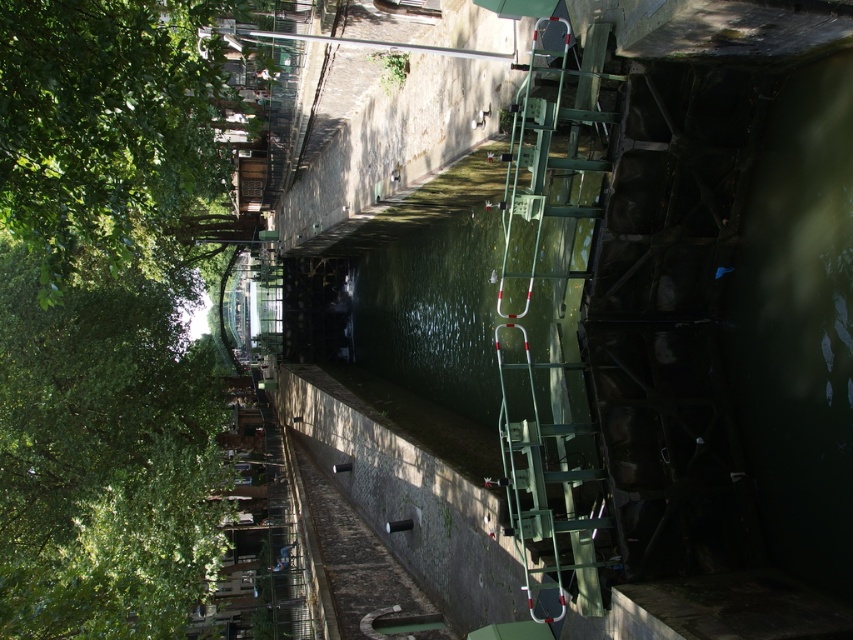
Question: Is green leafy tree at left wider than green metallic ladder at right?

Choices:
 (A) no
 (B) yes

Answer: (B)

Question: Is green leafy tree at left below green metallic ladder at right?

Choices:
 (A) no
 (B) yes

Answer: (B)

Question: Does green leafy tree at upper left appear over green metallic ladder at right?

Choices:
 (A) yes
 (B) no

Answer: (A)

Question: Estimate the real-world distances between objects in this image. Which object is farther from the green leafy tree at upper left?

Choices:
 (A) green metallic ladder at right
 (B) green leafy tree at left

Answer: (A)

Question: Which is farther from the green leafy tree at upper left?

Choices:
 (A) green metallic ladder at right
 (B) green leafy tree at left

Answer: (A)

Question: Which object appears farthest from the camera in this image?

Choices:
 (A) green metallic ladder at right
 (B) green leafy tree at left
 (C) green leafy tree at upper left

Answer: (B)